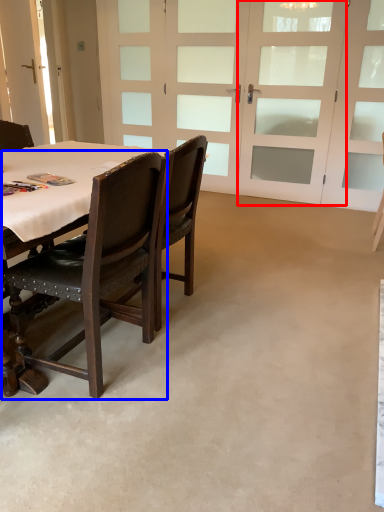
Question: Which point is further to the camera, screen door (highlighted by a red box) or chair (highlighted by a blue box)?

Choices:
 (A) screen door
 (B) chair

Answer: (A)